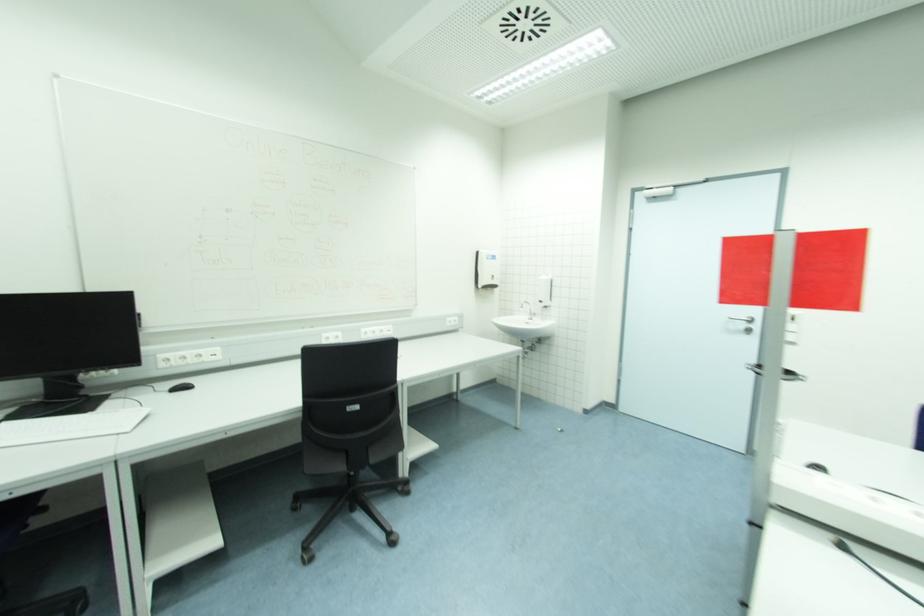
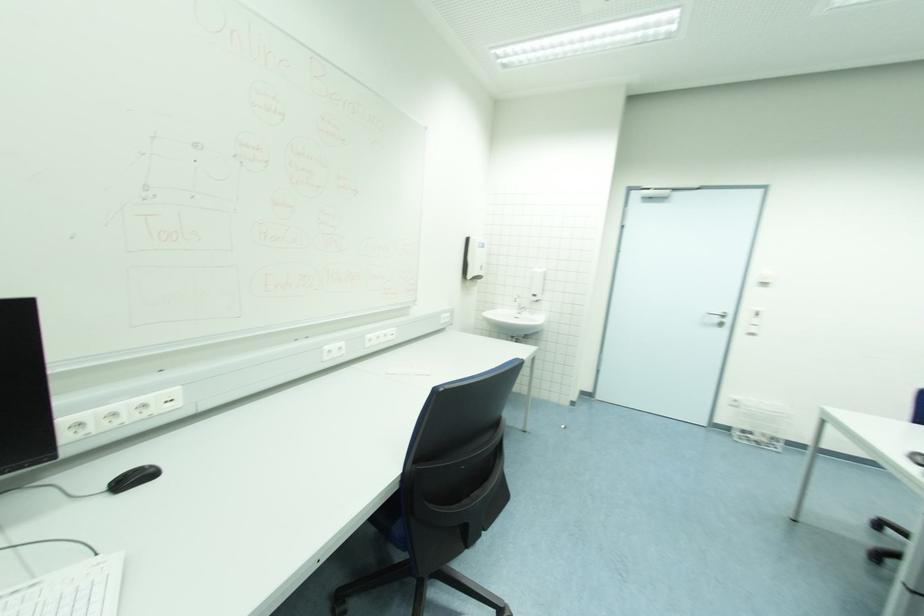
The images are taken continuously from a first-person perspective. In which direction are you moving?

The cameraman moved toward left, forward.